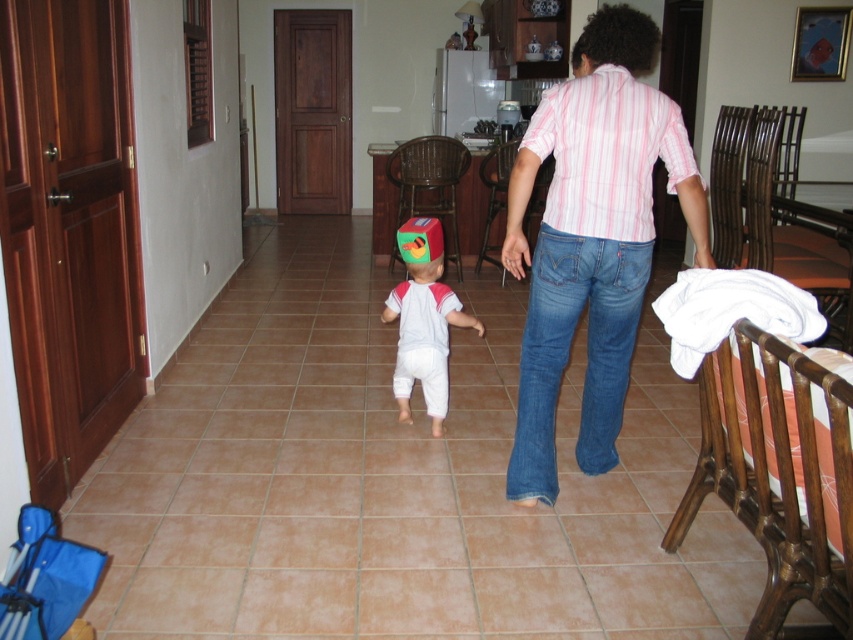
Question: Where is pink striped shirt at center located in relation to white cotton baby at center in the image?

Choices:
 (A) below
 (B) above

Answer: (B)

Question: Does pink striped shirt at center have a lesser width compared to white cotton baby at center?

Choices:
 (A) no
 (B) yes

Answer: (A)

Question: Does pink striped shirt at center have a lesser width compared to white cotton baby at center?

Choices:
 (A) yes
 (B) no

Answer: (B)

Question: Which point is farther to the camera?

Choices:
 (A) (393, 305)
 (B) (593, 42)

Answer: (A)